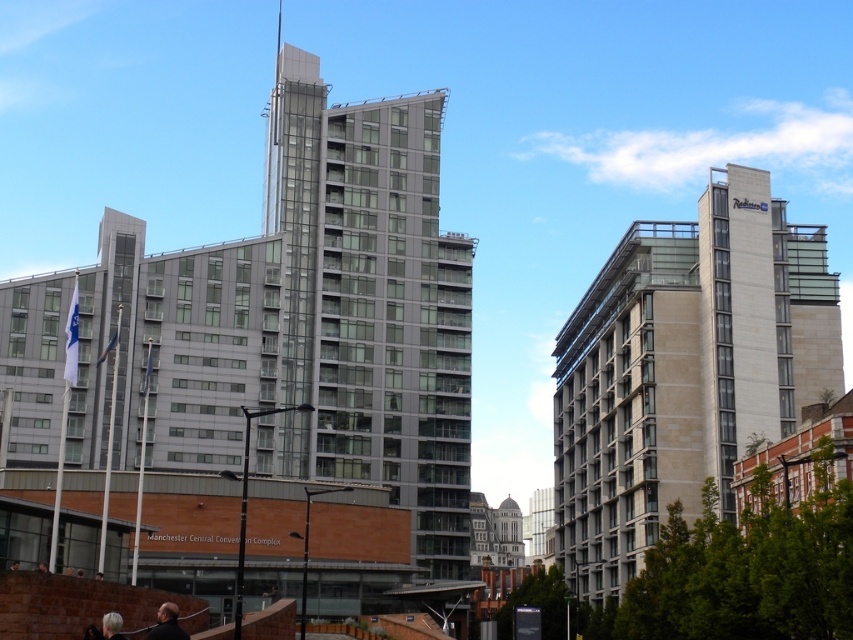
Question: Which object is positioned farthest from the beige stone building at right?

Choices:
 (A) blonde hair at lower left
 (B) glassy metallic building at center

Answer: (A)

Question: Observing the image, what is the correct spatial positioning of glassy metallic building at center in reference to dark brown leather jacket at lower center?

Choices:
 (A) right
 (B) left

Answer: (A)

Question: Among these points, which one is farthest from the camera?

Choices:
 (A) (119, 634)
 (B) (267, 230)

Answer: (B)

Question: Can you confirm if glassy metallic building at center is smaller than dark brown leather jacket at lower center?

Choices:
 (A) yes
 (B) no

Answer: (B)

Question: Which point appears farthest from the camera in this image?

Choices:
 (A) (109, 636)
 (B) (657, 392)
 (C) (322, 147)

Answer: (C)

Question: Does glassy metallic building at center have a lesser width compared to blonde hair at lower left?

Choices:
 (A) no
 (B) yes

Answer: (A)